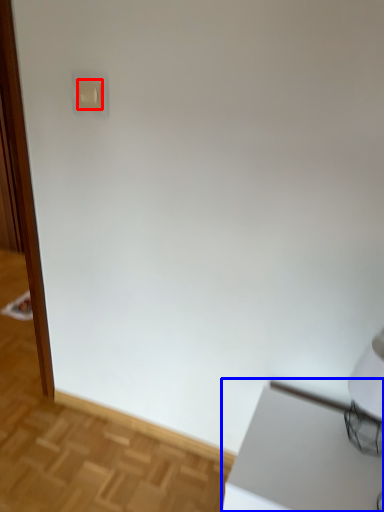
Question: Among these objects, which one is nearest to the camera, light switch (highlighted by a red box) or table (highlighted by a blue box)?

Choices:
 (A) light switch
 (B) table

Answer: (B)